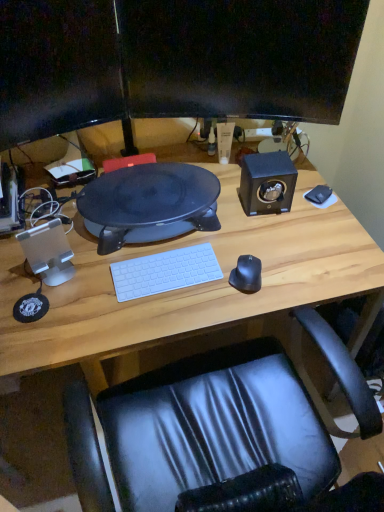
The width and height of the screenshot is (384, 512). I want to click on free space to the left of black matte speaker at upper right, the 1th speaker when ordered from top to bottom, so click(222, 211).